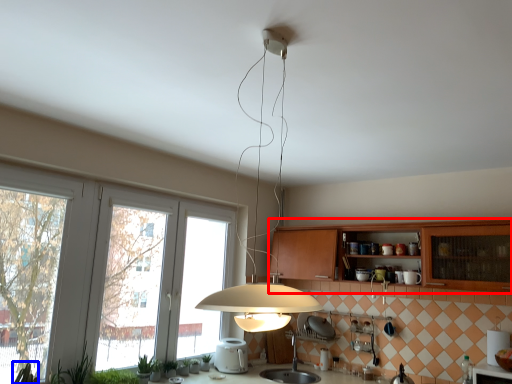
Question: Which point is closer to the camera, cabinetry (highlighted by a red box) or plant (highlighted by a blue box)?

Choices:
 (A) cabinetry
 (B) plant

Answer: (B)